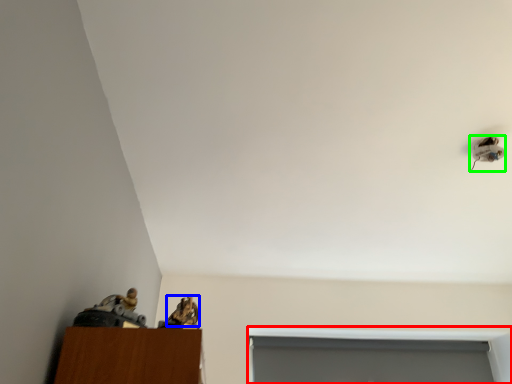
Question: Considering the real-world distances, which object is closest to window (highlighted by a red box)? animal (highlighted by a blue box) or lamp (highlighted by a green box).

Choices:
 (A) animal
 (B) lamp

Answer: (B)